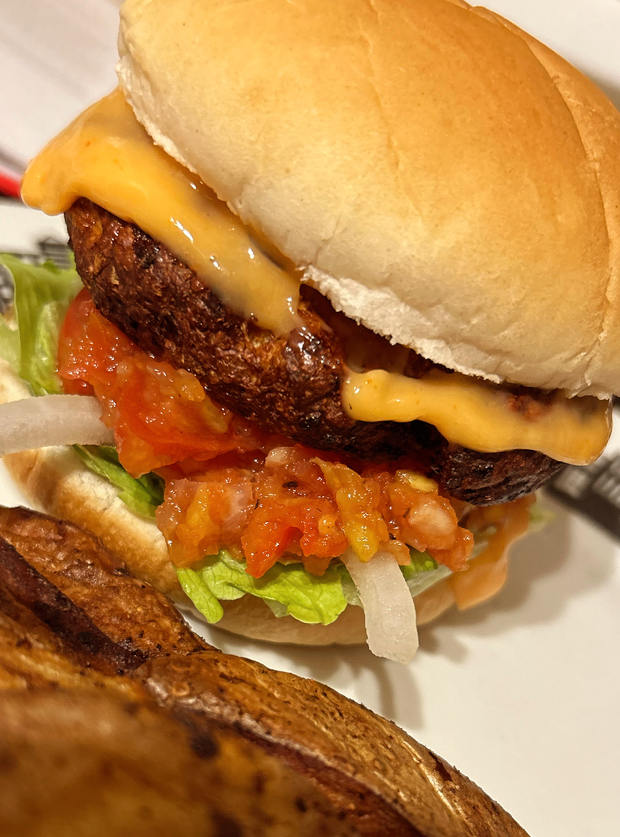
Identify the location of plate. (510, 634).